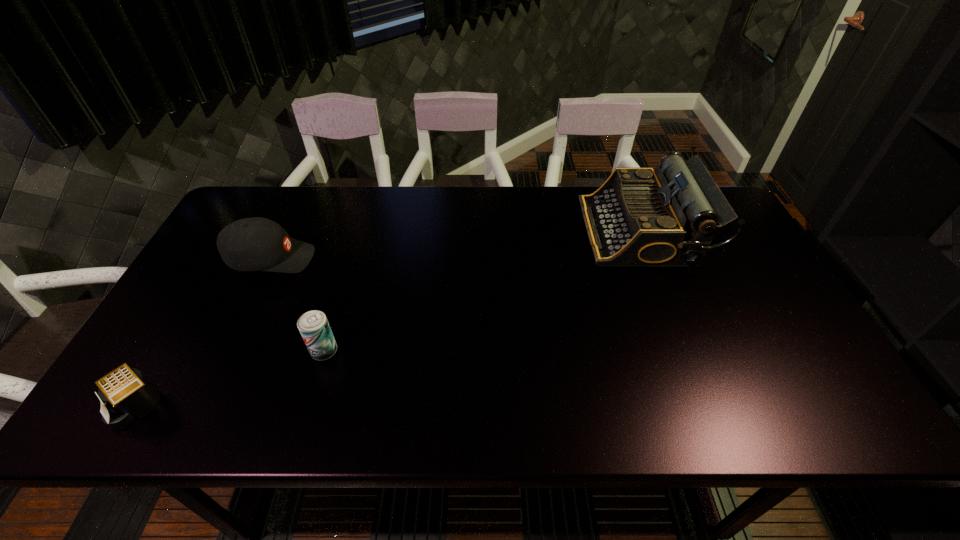
This screenshot has height=540, width=960. Identify the location of free space at the far edge. (356, 226).

The height and width of the screenshot is (540, 960). I want to click on vacant space at the near edge of the desktop, so click(x=338, y=406).

Identify the location of vacant area at the left edge of the desktop. The width and height of the screenshot is (960, 540). (222, 326).

Where is `vacant space at the right edge of the desktop`? The width and height of the screenshot is (960, 540). vacant space at the right edge of the desktop is located at coordinates (721, 272).

Where is `free space at the near right corner of the desktop`? free space at the near right corner of the desktop is located at coordinates (803, 427).

Locate an element on the screen. This screenshot has width=960, height=540. vacant area that lies between the second nearest object and the baseball cap is located at coordinates (298, 305).

Find the location of a particular element. The width and height of the screenshot is (960, 540). free area in between the shortest object and the baseball cap is located at coordinates (205, 332).

The width and height of the screenshot is (960, 540). Find the location of `free space between the typewriter and the shortest object`. free space between the typewriter and the shortest object is located at coordinates (390, 318).

Find the location of `free space between the beer can and the nearest object`. free space between the beer can and the nearest object is located at coordinates (231, 378).

Identify the location of free point between the tallest object and the beer can. The height and width of the screenshot is (540, 960). (483, 291).